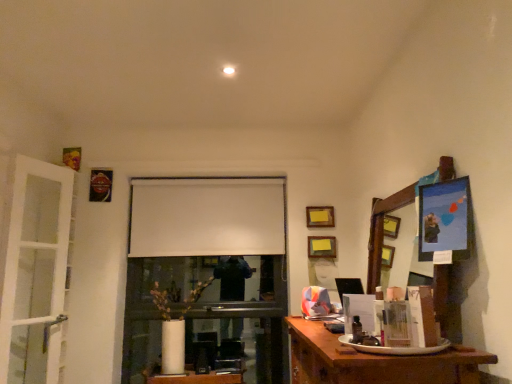
Describe the element at coordinates (320, 216) in the screenshot. Image resolution: width=512 pixels, height=384 pixels. I see `wooden picture frame at upper center, marked as the first picture frame in a top-to-bottom arrangement` at that location.

What do you see at coordinates (35, 273) in the screenshot? I see `white glass door at left` at bounding box center [35, 273].

Describe the element at coordinates (322, 247) in the screenshot. I see `yellow matte picture frame at upper center, positioned as the 1th picture frame in bottom-to-top order` at that location.

Describe the element at coordinates (206, 217) in the screenshot. I see `white matte projection screen at center` at that location.

Where is `wooden desk at lower right`? The image size is (512, 384). wooden desk at lower right is located at coordinates (374, 362).

Is white matte projection screen at center positioned before wooden picture frame at upper center, which is the second picture frame in bottom-to-top order?

No, white matte projection screen at center is further to the viewer.

Are white matte projection screen at center and wooden picture frame at upper center, marked as the first picture frame in a top-to-bottom arrangement, far apart?

That's not correct — white matte projection screen at center is a little close to wooden picture frame at upper center, marked as the first picture frame in a top-to-bottom arrangement.

Which is behind, point (225, 237) or point (327, 222)?

The point (225, 237) is more distant.

From a real-world perspective, does white matte projection screen at center sit lower than wooden picture frame at upper center, marked as the first picture frame in a top-to-bottom arrangement?

No, from a real-world perspective, white matte projection screen at center is not below wooden picture frame at upper center, marked as the first picture frame in a top-to-bottom arrangement.

Is the surface of white glass door at left in direct contact with wooden picture frame at upper center, marked as the first picture frame in a top-to-bottom arrangement?

There is a gap between white glass door at left and wooden picture frame at upper center, marked as the first picture frame in a top-to-bottom arrangement.

Does white glass door at left come behind wooden picture frame at upper center, which is the second picture frame in bottom-to-top order?

No.

Considering the points (16, 201) and (325, 213), which point is in front, point (16, 201) or point (325, 213)?

The point (16, 201) is in front.

Is white glass door at left bigger or smaller than wooden picture frame at upper center, marked as the first picture frame in a top-to-bottom arrangement?

Clearly, white glass door at left is larger in size than wooden picture frame at upper center, marked as the first picture frame in a top-to-bottom arrangement.

Based on the photo, is white glass door at left not inside wooden desk at lower right?

Absolutely, white glass door at left is external to wooden desk at lower right.

Is white glass door at left far from wooden desk at lower right?

Yes.

What's the angular difference between white glass door at left and wooden desk at lower right's facing directions?

They differ by 158 degrees in their facing directions.

Considering the sizes of objects white glass door at left and wooden desk at lower right in the image provided, who is taller, white glass door at left or wooden desk at lower right?

With more height is white glass door at left.

Are wooden picture frame at upper center, marked as the first picture frame in a top-to-bottom arrangement, and yellow matte picture frame at upper center, positioned as the 1th picture frame in bottom-to-top order, making contact?

No, wooden picture frame at upper center, marked as the first picture frame in a top-to-bottom arrangement, is not touching yellow matte picture frame at upper center, positioned as the 1th picture frame in bottom-to-top order.

Is wooden picture frame at upper center, marked as the first picture frame in a top-to-bottom arrangement, smaller than yellow matte picture frame at upper center, which appears as the second picture frame when viewed from the top?

Correct, wooden picture frame at upper center, marked as the first picture frame in a top-to-bottom arrangement, occupies less space than yellow matte picture frame at upper center, which appears as the second picture frame when viewed from the top.

Does wooden picture frame at upper center, marked as the first picture frame in a top-to-bottom arrangement, appear on the left side of yellow matte picture frame at upper center, positioned as the 1th picture frame in bottom-to-top order?

Yes, wooden picture frame at upper center, marked as the first picture frame in a top-to-bottom arrangement, is to the left of yellow matte picture frame at upper center, positioned as the 1th picture frame in bottom-to-top order.

Based on the photo, is wooden picture frame at upper center, which is the second picture frame in bottom-to-top order, oriented towards yellow matte picture frame at upper center, which appears as the second picture frame when viewed from the top?

No, wooden picture frame at upper center, which is the second picture frame in bottom-to-top order, is not aimed at yellow matte picture frame at upper center, which appears as the second picture frame when viewed from the top.

Is yellow matte picture frame at upper center, positioned as the 1th picture frame in bottom-to-top order, directly adjacent to white glass door at left?

yellow matte picture frame at upper center, positioned as the 1th picture frame in bottom-to-top order, and white glass door at left are not in contact.

From a real-world perspective, is yellow matte picture frame at upper center, positioned as the 1th picture frame in bottom-to-top order, beneath white glass door at left?

No.

Which object is wider, yellow matte picture frame at upper center, which appears as the second picture frame when viewed from the top, or white glass door at left?

white glass door at left.

From the white glass door at left, count 1st picture frames backward and point to it. Please provide its 2D coordinates.

[(322, 247)]

How different are the orientations of yellow matte picture frame at upper center, which appears as the second picture frame when viewed from the top, and wooden picture frame at upper center, marked as the first picture frame in a top-to-bottom arrangement, in degrees?

The angular difference between yellow matte picture frame at upper center, which appears as the second picture frame when viewed from the top, and wooden picture frame at upper center, marked as the first picture frame in a top-to-bottom arrangement, is 0.00244 degrees.

This screenshot has width=512, height=384. What are the coordinates of `picture frame that appears above the yellow matte picture frame at upper center, which appears as the second picture frame when viewed from the top (from a real-world perspective)` in the screenshot? It's located at 320,216.

Is yellow matte picture frame at upper center, which appears as the second picture frame when viewed from the top, beside wooden picture frame at upper center, marked as the first picture frame in a top-to-bottom arrangement?

No.

How far apart are yellow matte picture frame at upper center, which appears as the second picture frame when viewed from the top, and wooden picture frame at upper center, marked as the first picture frame in a top-to-bottom arrangement?

yellow matte picture frame at upper center, which appears as the second picture frame when viewed from the top, is 5.65 inches away from wooden picture frame at upper center, marked as the first picture frame in a top-to-bottom arrangement.

From a real-world perspective, is white matte projection screen at center physically above yellow matte picture frame at upper center, which appears as the second picture frame when viewed from the top?

Yes, from a real-world perspective, white matte projection screen at center is over yellow matte picture frame at upper center, which appears as the second picture frame when viewed from the top

Consider the image. Is white matte projection screen at center with yellow matte picture frame at upper center, positioned as the 1th picture frame in bottom-to-top order?

No, white matte projection screen at center is not with yellow matte picture frame at upper center, positioned as the 1th picture frame in bottom-to-top order.

Considering the positions of objects white matte projection screen at center and yellow matte picture frame at upper center, which appears as the second picture frame when viewed from the top, in the image provided, who is in front, white matte projection screen at center or yellow matte picture frame at upper center, which appears as the second picture frame when viewed from the top,?

yellow matte picture frame at upper center, which appears as the second picture frame when viewed from the top, is closer to the camera.

Considering the sizes of white matte projection screen at center and yellow matte picture frame at upper center, positioned as the 1th picture frame in bottom-to-top order, in the image, is white matte projection screen at center taller or shorter than yellow matte picture frame at upper center, positioned as the 1th picture frame in bottom-to-top order,?

Clearly, white matte projection screen at center is taller compared to yellow matte picture frame at upper center, positioned as the 1th picture frame in bottom-to-top order.

The width and height of the screenshot is (512, 384). I want to click on projection screen below the wooden picture frame at upper center, which is the second picture frame in bottom-to-top order (from the image's perspective), so click(206, 217).

From the white glass door at left, count 2nd picture frames backward and point to it. Please provide its 2D coordinates.

[(320, 216)]

When comparing their distances from wooden picture frame at upper center, marked as the first picture frame in a top-to-bottom arrangement, does wooden desk at lower right or white glass door at left seem further?

Based on the image, white glass door at left appears to be further to wooden picture frame at upper center, marked as the first picture frame in a top-to-bottom arrangement.

Which object lies nearer to the anchor point yellow matte picture frame at upper center, which appears as the second picture frame when viewed from the top, white matte projection screen at center or wooden picture frame at upper center, marked as the first picture frame in a top-to-bottom arrangement?

wooden picture frame at upper center, marked as the first picture frame in a top-to-bottom arrangement.

Considering their positions, is white matte projection screen at center positioned closer to yellow matte picture frame at upper center, which appears as the second picture frame when viewed from the top, than white glass door at left?

white matte projection screen at center is positioned closer to the anchor yellow matte picture frame at upper center, which appears as the second picture frame when viewed from the top.

Estimate the real-world distances between objects in this image. Which object is further from white matte projection screen at center, wooden desk at lower right or wooden picture frame at upper center, which is the second picture frame in bottom-to-top order?

wooden desk at lower right is further to white matte projection screen at center.

Based on their spatial positions, is white glass door at left or wooden picture frame at upper center, which is the second picture frame in bottom-to-top order, further from yellow matte picture frame at upper center, which appears as the second picture frame when viewed from the top?

Among the two, white glass door at left is located further to yellow matte picture frame at upper center, which appears as the second picture frame when viewed from the top.

From the image, which object appears to be farther from white glass door at left, wooden picture frame at upper center, which is the second picture frame in bottom-to-top order, or wooden desk at lower right?

wooden picture frame at upper center, which is the second picture frame in bottom-to-top order, lies further to white glass door at left than the other object.

When comparing their distances from white matte projection screen at center, does wooden picture frame at upper center, which is the second picture frame in bottom-to-top order, or white glass door at left seem further?

Among the two, white glass door at left is located further to white matte projection screen at center.

From the image, which object appears to be nearer to white glass door at left, wooden picture frame at upper center, marked as the first picture frame in a top-to-bottom arrangement, or yellow matte picture frame at upper center, which appears as the second picture frame when viewed from the top?

yellow matte picture frame at upper center, which appears as the second picture frame when viewed from the top, is closer to white glass door at left.

What are the coordinates of `desk between white glass door at left and wooden picture frame at upper center, which is the second picture frame in bottom-to-top order, from left to right` in the screenshot? It's located at (374, 362).

You are a GUI agent. You are given a task and a screenshot of the screen. Output one action in this format:
    pyautogui.click(x=<x>, y=<y>)
    Task: Click on the projection screen between white glass door at left and yellow matte picture frame at upper center, positioned as the 1th picture frame in bottom-to-top order, from left to right
    The height and width of the screenshot is (384, 512).
    Given the screenshot: What is the action you would take?
    pyautogui.click(x=206, y=217)

At what (x,y) coordinates should I click in order to perform the action: click on picture frame between wooden desk at lower right and wooden picture frame at upper center, which is the second picture frame in bottom-to-top order, along the z-axis. Please return your answer as a coordinate pair (x, y). Looking at the image, I should click on (x=322, y=247).

I want to click on picture frame between white matte projection screen at center and yellow matte picture frame at upper center, which appears as the second picture frame when viewed from the top, so click(x=320, y=216).